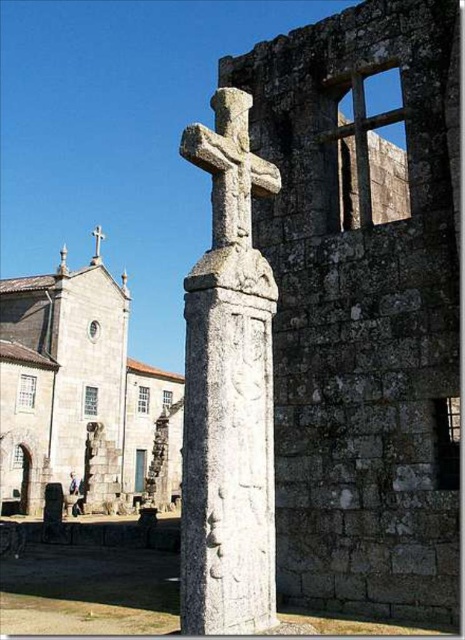
You are a tourist visiting the historical site and want to take a photo that includes both the gray stone church at center and the white stone cross at center. Since you want the church to be the main focus, which object should you position closer to the camera to ensure the church appears larger in the photo?

To make the gray stone church at center appear larger in the photo, you should position yourself closer to the gray stone church at center. Since the gray stone church at center is taller than the white stone cross at center, being closer to it will emphasize its size relative to the cross.